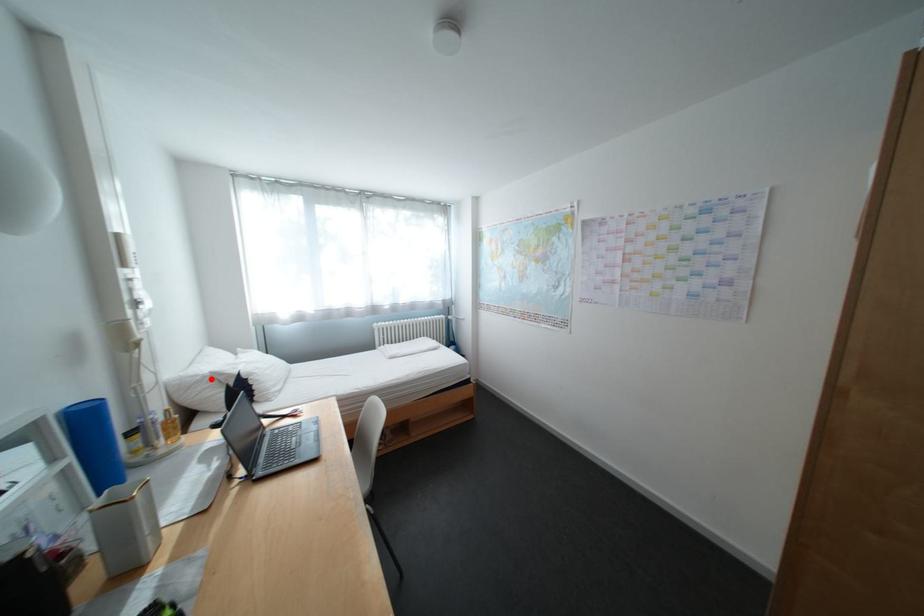
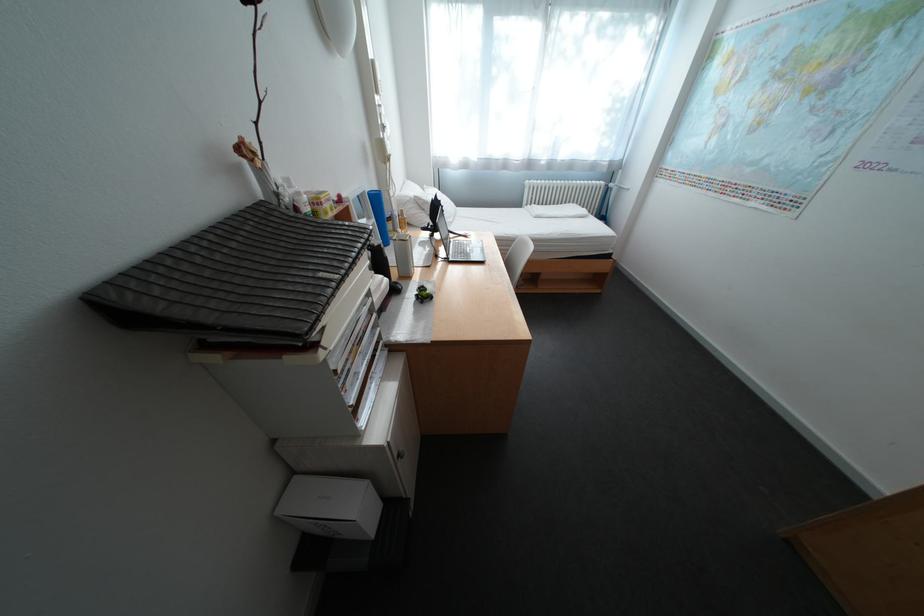
Where in the second image is the point corresponding to the highlighted location from the first image?

(420, 200)